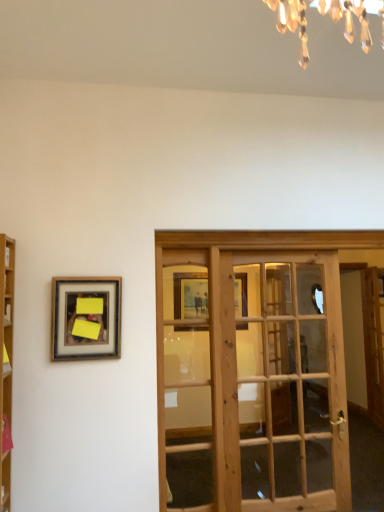
Question: From their relative heights in the image, would you say wooden bookshelf at left is taller or shorter than wooden framed picture at left?

Choices:
 (A) tall
 (B) short

Answer: (A)

Question: From a real-world perspective, is wooden bookshelf at left physically located above or below wooden framed picture at left?

Choices:
 (A) below
 (B) above

Answer: (A)

Question: Which object is the farthest from the wooden french door at center?

Choices:
 (A) wooden framed picture at left
 (B) wooden bookshelf at left

Answer: (B)

Question: Which object is positioned closest to the wooden framed picture at left?

Choices:
 (A) wooden bookshelf at left
 (B) wooden french door at center

Answer: (A)